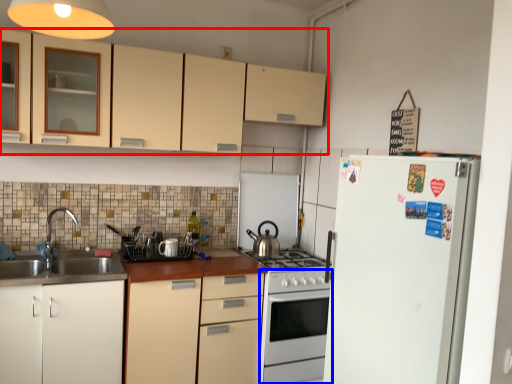
Question: Which point is closer to the camera, cabinetry (highlighted by a red box) or oven (highlighted by a blue box)?

Choices:
 (A) cabinetry
 (B) oven

Answer: (A)